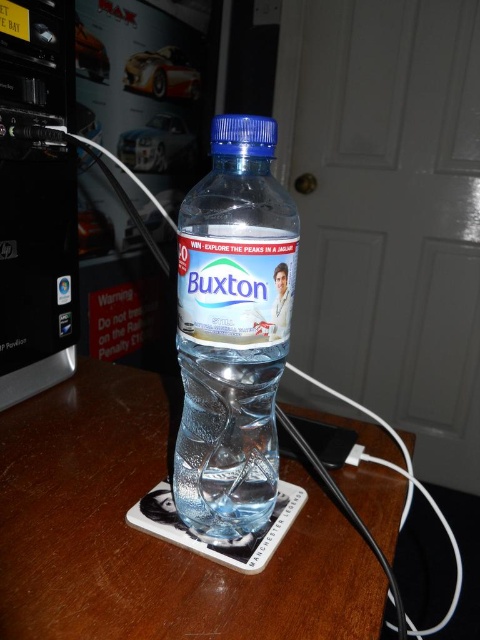
Does clear wood coaster at center lie in front of clear plastic bottle at center?

Yes, it is.

Is clear wood coaster at center to the right of clear plastic bottle at center from the viewer's perspective?

Incorrect, clear wood coaster at center is not on the right side of clear plastic bottle at center.

The width and height of the screenshot is (480, 640). What do you see at coordinates (151, 536) in the screenshot?
I see `clear wood coaster at center` at bounding box center [151, 536].

Identify the location of clear wood coaster at center. The height and width of the screenshot is (640, 480). (151, 536).